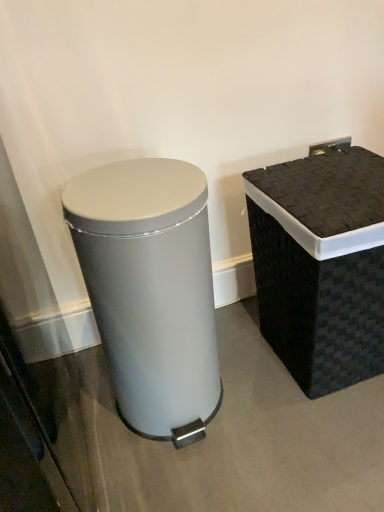
Question: Is black woven basket at right, the first waste container viewed from the right, taller or shorter than satin silver trash can at left, positioned as the first waste container in left-to-right order?

Choices:
 (A) short
 (B) tall

Answer: (A)

Question: From a real-world perspective, is black woven basket at right, the first waste container viewed from the right, above or below satin silver trash can at left, marked as the second waste container in a right-to-left arrangement?

Choices:
 (A) above
 (B) below

Answer: (B)

Question: Looking at the image, does black woven basket at right, which is counted as the second waste container, starting from the left, seem bigger or smaller compared to satin silver trash can at left, marked as the second waste container in a right-to-left arrangement?

Choices:
 (A) big
 (B) small

Answer: (A)

Question: From a real-world perspective, is satin silver trash can at left, positioned as the first waste container in left-to-right order, positioned above or below black woven basket at right, the first waste container viewed from the right?

Choices:
 (A) below
 (B) above

Answer: (B)

Question: Based on their sizes in the image, would you say satin silver trash can at left, positioned as the first waste container in left-to-right order, is bigger or smaller than black woven basket at right, the first waste container viewed from the right?

Choices:
 (A) small
 (B) big

Answer: (A)

Question: Does point (114, 359) appear closer or farther from the camera than point (357, 198)?

Choices:
 (A) closer
 (B) farther

Answer: (B)

Question: From the image's perspective, is satin silver trash can at left, marked as the second waste container in a right-to-left arrangement, above or below black woven basket at right, the first waste container viewed from the right?

Choices:
 (A) below
 (B) above

Answer: (A)